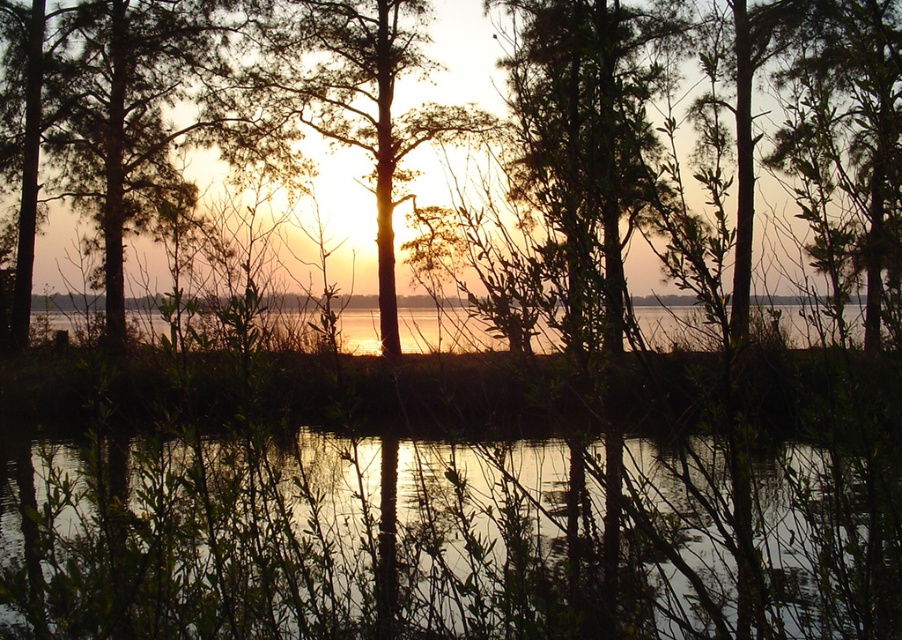
Does green leafy tree at center have a smaller size compared to silhouette bark tree at center?

No, green leafy tree at center is not smaller than silhouette bark tree at center.

Which of these two, green leafy tree at center or silhouette bark tree at center, stands taller?

With more height is green leafy tree at center.

Is point (743, 234) closer to camera compared to point (403, 19)?

Yes, it is.

At what (x,y) coordinates should I click in order to perform the action: click on green leafy tree at center. Please return your answer as a coordinate pair (x, y). Looking at the image, I should click on (822, 124).

Which is behind, point (130, 592) or point (286, 83)?

The point (286, 83) is behind.

Can you confirm if transparent water at center is wider than silhouette bark tree at center?

Yes.

Identify the location of transparent water at center. The image size is (902, 640). (351, 541).

Who is higher up, transparent water at center or green leafy tree at center?

green leafy tree at center is above.

Can you confirm if transparent water at center is taller than green leafy tree at center?

No, transparent water at center is not taller than green leafy tree at center.

What do you see at coordinates (351, 541) in the screenshot? This screenshot has height=640, width=902. I see `transparent water at center` at bounding box center [351, 541].

The width and height of the screenshot is (902, 640). Find the location of `transparent water at center`. transparent water at center is located at coordinates (351, 541).